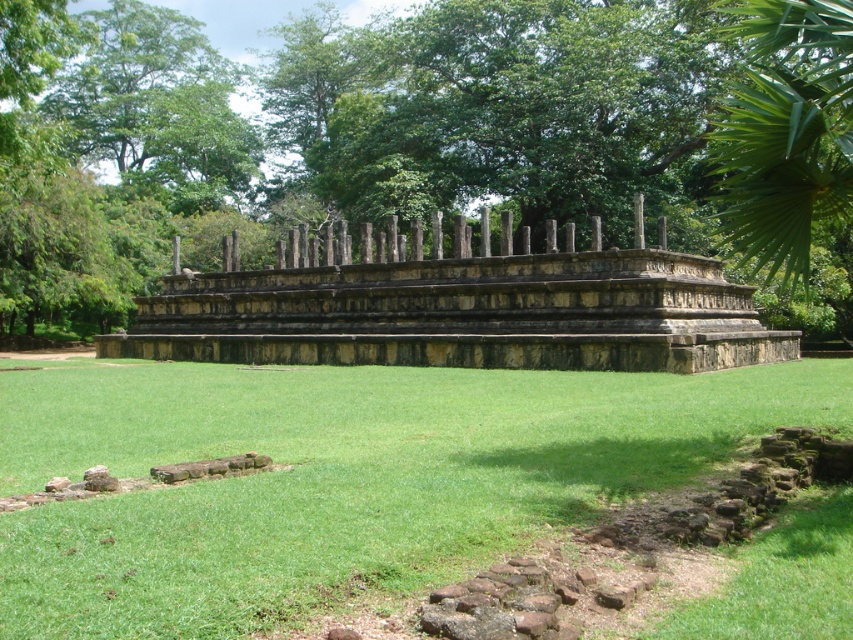
Is stone ruins at center bigger than green leafy tree at upper left?

No, stone ruins at center is not bigger than green leafy tree at upper left.

Can you confirm if stone ruins at center is positioned to the right of green leafy tree at upper left?

Correct, you'll find stone ruins at center to the right of green leafy tree at upper left.

At what (x,y) coordinates should I click in order to perform the action: click on stone ruins at center. Please return your answer as a coordinate pair (x, y). The height and width of the screenshot is (640, 853). Looking at the image, I should click on (463, 314).

Between point (442, 76) and point (117, 97), which one is positioned behind?

The point (117, 97) is behind.

Who is positioned more to the right, green leafy tree at upper center or green leafy tree at upper left?

green leafy tree at upper center is more to the right.

You are a GUI agent. You are given a task and a screenshot of the screen. Output one action in this format:
    pyautogui.click(x=<x>, y=<y>)
    Task: Click on the green leafy tree at upper center
    The image size is (853, 640).
    Given the screenshot: What is the action you would take?
    pyautogui.click(x=337, y=132)

How much distance is there between green leafy tree at upper center and stone ruins at center?

The distance of green leafy tree at upper center from stone ruins at center is 42.39 meters.

Between green leafy tree at upper center and stone ruins at center, which one appears on the left side from the viewer's perspective?

green leafy tree at upper center

Image resolution: width=853 pixels, height=640 pixels. Identify the location of green leafy tree at upper center. (337, 132).

Where is `green leafy tree at upper center`? Image resolution: width=853 pixels, height=640 pixels. green leafy tree at upper center is located at coordinates click(337, 132).